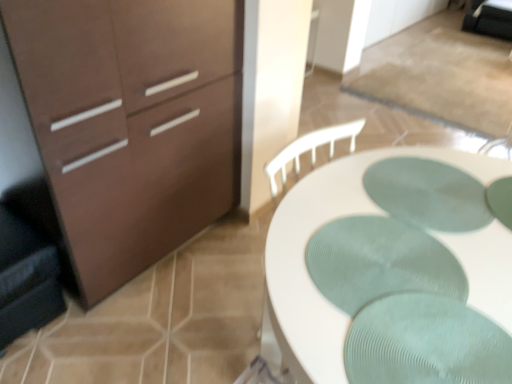
Question: From the image's perspective, is matte brown cabinet at left above or below green textured placemat at center, marked as the 2th oval in a bottom-to-top arrangement?

Choices:
 (A) above
 (B) below

Answer: (A)

Question: Considering the positions of matte brown cabinet at left and green textured placemat at center, which appears as the first oval when viewed from the top, in the image, is matte brown cabinet at left wider or thinner than green textured placemat at center, which appears as the first oval when viewed from the top,?

Choices:
 (A) wide
 (B) thin

Answer: (A)

Question: Which is nearer to the matte brown cabinet at left?

Choices:
 (A) green ribbed placemat at center, which is the 2th oval in back-to-front order
 (B) green textured placemat at center, marked as the 2th oval in a bottom-to-top arrangement
 (C) dark gray fabric swivel chair at left
 (D) white textured desk at center

Answer: (C)

Question: Based on their relative distances, which object is farther from the white textured desk at center?

Choices:
 (A) dark gray fabric swivel chair at left
 (B) green textured placemat at center, positioned as the first oval in back-to-front order
 (C) green ribbed placemat at center, the second oval from the top
 (D) matte brown cabinet at left

Answer: (A)